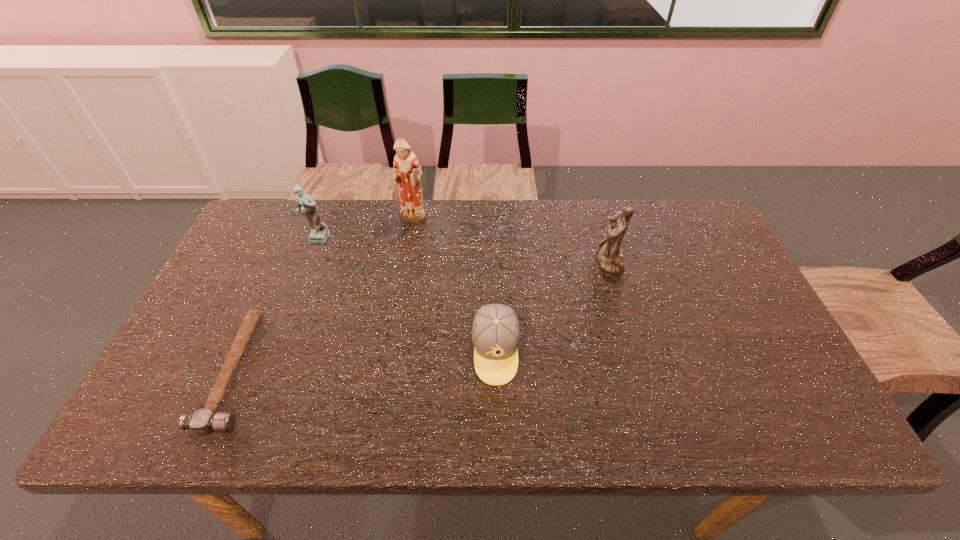
Where is `the tallest figurine`? The width and height of the screenshot is (960, 540). the tallest figurine is located at coordinates (407, 171).

Where is `the second figurine from right to left`? the second figurine from right to left is located at coordinates point(407,171).

At what (x,y) coordinates should I click in order to perform the action: click on the leftmost figurine. Please return your answer as a coordinate pair (x, y). Looking at the image, I should click on (319, 235).

Locate an element on the screen. Image resolution: width=960 pixels, height=540 pixels. the rightmost figurine is located at coordinates (609, 257).

I want to click on the second shortest object, so click(x=495, y=334).

Find the location of a particular element. The image size is (960, 540). the fourth object from left to right is located at coordinates (495, 334).

Locate an element on the screen. hammer is located at coordinates (203, 422).

Find the location of a particular element. vacant area situated on the front-facing side of the farthest object is located at coordinates (396, 318).

Locate an element on the screen. free spot located on the front-facing side of the leftmost figurine is located at coordinates (287, 318).

Image resolution: width=960 pixels, height=540 pixels. Identify the location of free point located 0.230m on the front-facing side of the rightmost figurine. (518, 261).